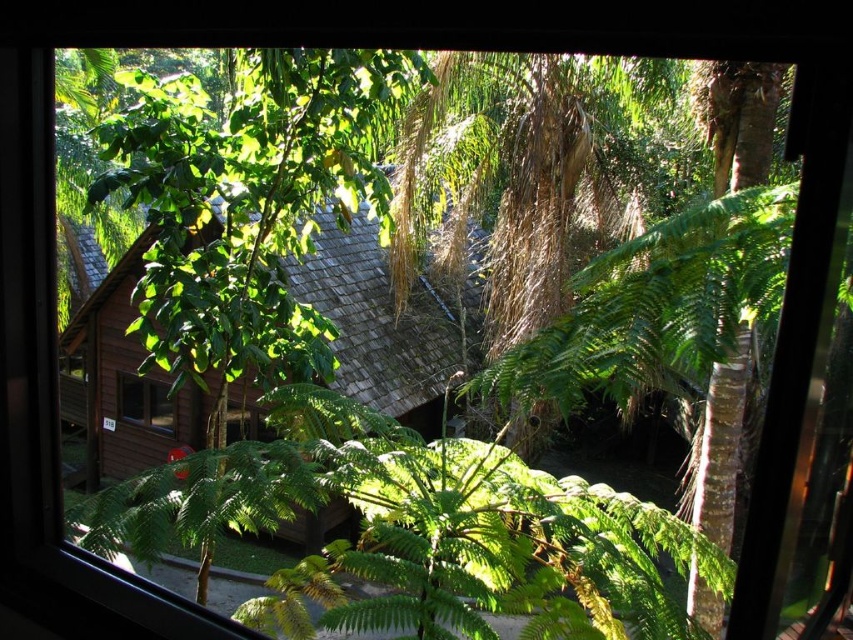
Is brown wooden hut at center to the right of matte wooden window at center from the viewer's perspective?

Indeed, brown wooden hut at center is positioned on the right side of matte wooden window at center.

Measure the distance between brown wooden hut at center and camera.

The distance of brown wooden hut at center from camera is 9.35 meters.

At what (x,y) coordinates should I click in order to perform the action: click on brown wooden hut at center. Please return your answer as a coordinate pair (x, y). Looking at the image, I should click on (387, 324).

Is green leafy fern at center positioned in front of brown wooden hut at center?

Yes.

Is green leafy fern at center above brown wooden hut at center?

Incorrect, green leafy fern at center is not positioned above brown wooden hut at center.

Locate an element on the screen. The image size is (853, 640). green leafy fern at center is located at coordinates (416, 531).

Identify the location of green leafy fern at center. (416, 531).

The width and height of the screenshot is (853, 640). What do you see at coordinates (416, 531) in the screenshot?
I see `green leafy fern at center` at bounding box center [416, 531].

Does green leafy fern at center appear on the right side of matte wooden window at center?

Indeed, green leafy fern at center is positioned on the right side of matte wooden window at center.

In order to click on green leafy fern at center in this screenshot , I will do `click(416, 531)`.

Identify the location of green leafy fern at center. The width and height of the screenshot is (853, 640). (416, 531).